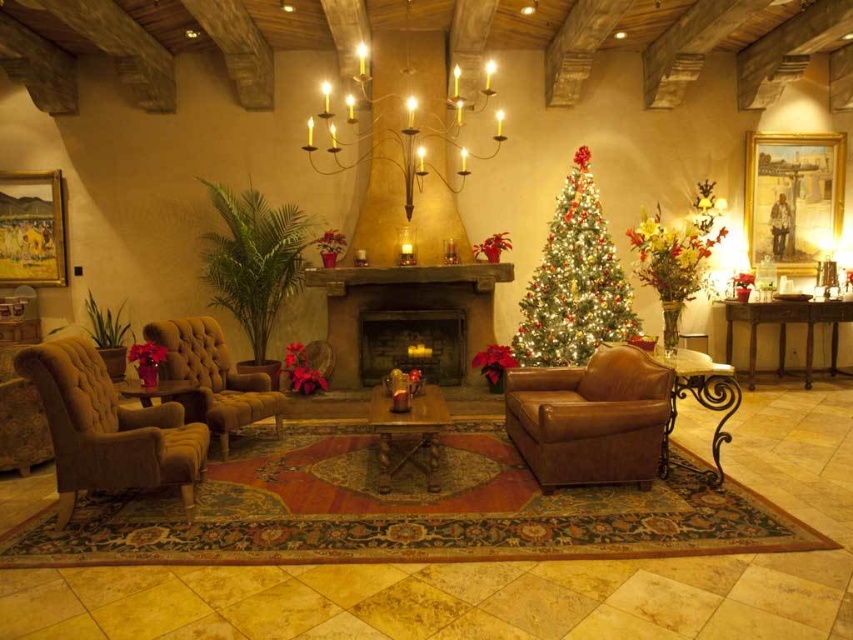
Who is more forward, (599, 307) or (398, 355)?

Point (599, 307) is in front.

Who is higher up, green matte christmas tree at center or dark stone fireplace at center?

green matte christmas tree at center

Does point (546, 234) lie behind point (451, 372)?

That is True.

The height and width of the screenshot is (640, 853). Find the location of `green matte christmas tree at center`. green matte christmas tree at center is located at coordinates (573, 282).

Between point (364, 310) and point (793, 307), which one is positioned behind?

The point (793, 307) is more distant.

Describe the element at coordinates (412, 342) in the screenshot. The width and height of the screenshot is (853, 640). I see `dark stone fireplace at center` at that location.

Is point (465, 344) in front of point (838, 372)?

Yes.

Find the location of a particular element. The image size is (853, 640). dark stone fireplace at center is located at coordinates (412, 342).

Is green matte christmas tree at center above rustic stone fireplace at center?

Yes, green matte christmas tree at center is above rustic stone fireplace at center.

Does green matte christmas tree at center have a greater width compared to rustic stone fireplace at center?

No.

The image size is (853, 640). Identify the location of green matte christmas tree at center. (573, 282).

Locate an element on the screen. This screenshot has width=853, height=640. green matte christmas tree at center is located at coordinates (573, 282).